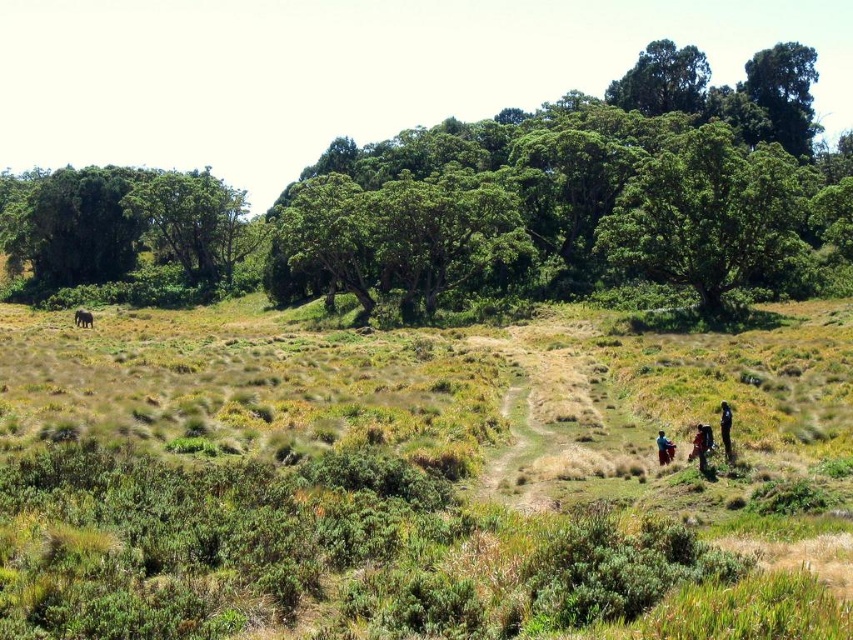
You are a hiker who has just placed your brown leather backpack at lower right. You notice a green leafy tree at upper right in the distance. Which direction should you walk to reach the tree from your backpack?

The green leafy tree at upper right is to the right of the brown leather backpack at lower right, so you should walk towards the right direction to reach the tree from your backpack.

You are standing at the edge of the grassland and see both the brown leather backpack at lower right and the blue fabric person at lower right. Which object is nearer to you?

The brown leather backpack at lower right is closer to the viewer than the blue fabric person at lower right.

You are hiking along the dirt path in the image and notice both the green leafy tree at upper right and the brown leather backpack at lower right. Which object is closer to you from your current position?

The green leafy tree at upper right is closer to you because the brown leather backpack at lower right is behind it.